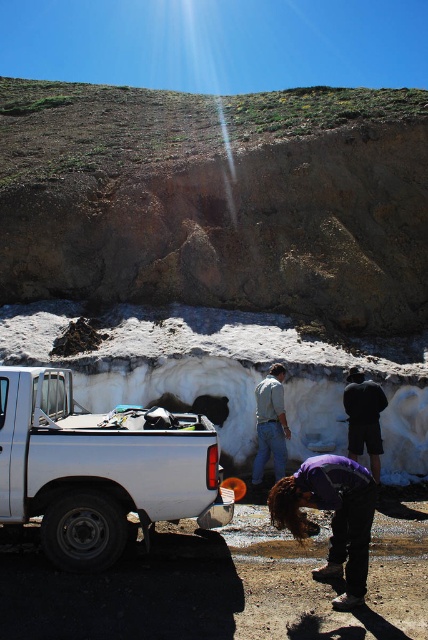
Question: Which point is closer to the camera taking this photo?

Choices:
 (A) (362, 467)
 (B) (109, 506)

Answer: (B)

Question: Which point is farther from the camera taking this photo?

Choices:
 (A) (404, 179)
 (B) (351, 417)

Answer: (A)

Question: Is purple fabric at lower center positioned at the back of dark blue fabric at center?

Choices:
 (A) yes
 (B) no

Answer: (B)

Question: Is brown rough rock at upper center further to the viewer compared to light gray cotton shirt at center?

Choices:
 (A) yes
 (B) no

Answer: (A)

Question: Is purple fabric at lower center smaller than light gray cotton shirt at center?

Choices:
 (A) no
 (B) yes

Answer: (A)

Question: Estimate the real-world distances between objects in this image. Which object is closer to the brown rough rock at upper center?

Choices:
 (A) purple fabric at lower center
 (B) light gray cotton shirt at center

Answer: (B)